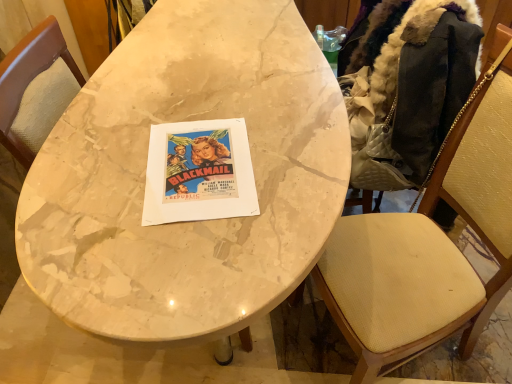
I want to click on vacant area on top of marble table at center (from a real-world perspective), so click(x=200, y=83).